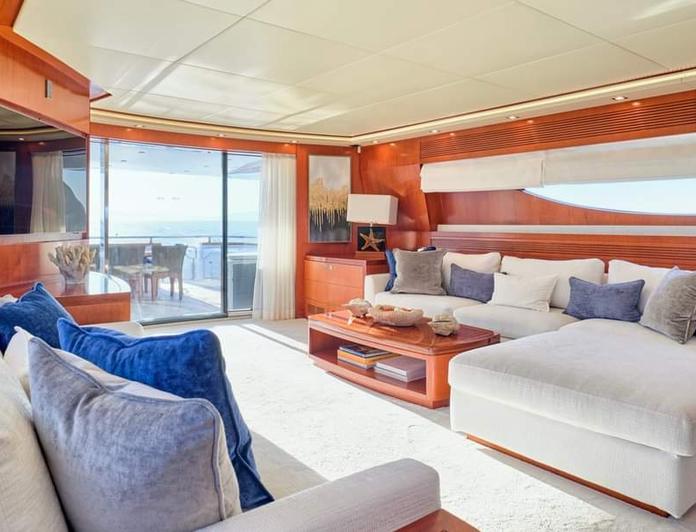
At what (x,y) coordinates should I click in order to perform the action: click on cushion. Please return your answer as a coordinate pair (x, y). This screenshot has height=532, width=696. Looking at the image, I should click on (507, 303), (553, 395), (285, 456).